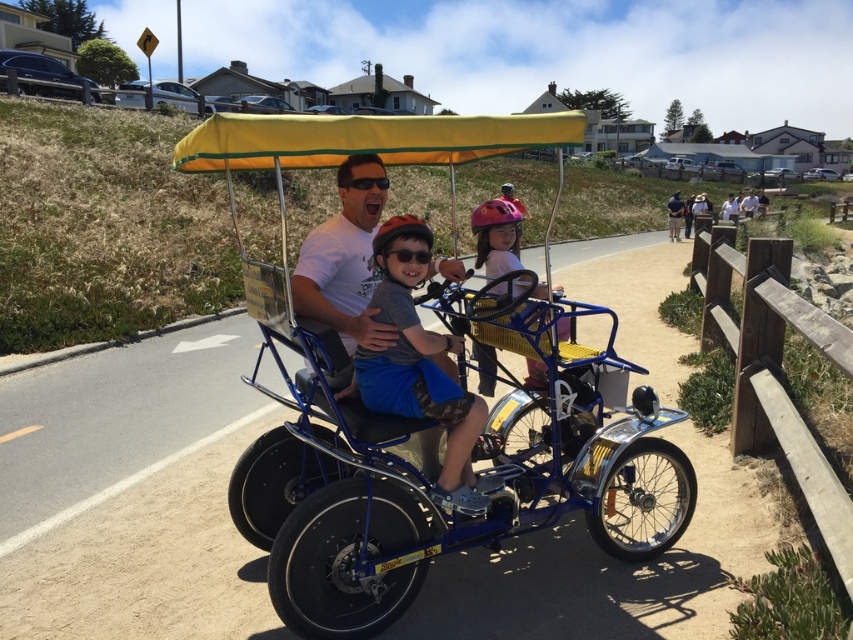
You are a pedestrian standing on the path and see the blue metallic golf cart at center and the matte blue shorts at center. Which object is closer to you?

The blue metallic golf cart at center is closer to you because it is in front of the matte blue shorts at center.

You are a photographer standing on the side of the path. You want to take a photo of the matte blue shorts at center and the matte blue tricycle at center such that both are clearly visible. Which object should you focus on first to ensure proper focus, considering their heights?

The matte blue shorts at center has a greater height compared to the matte blue tricycle at center, so you should focus on the matte blue shorts at center first to ensure proper focus.